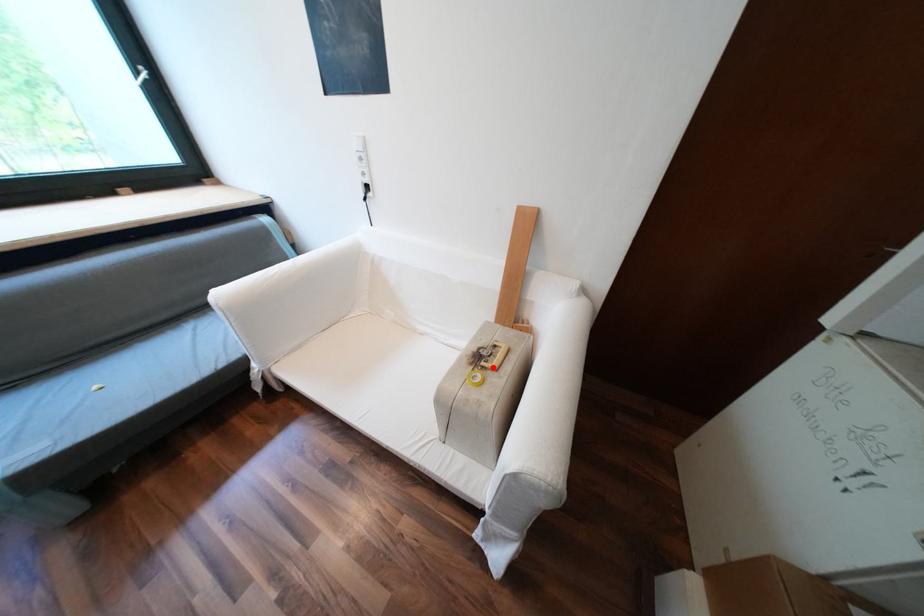
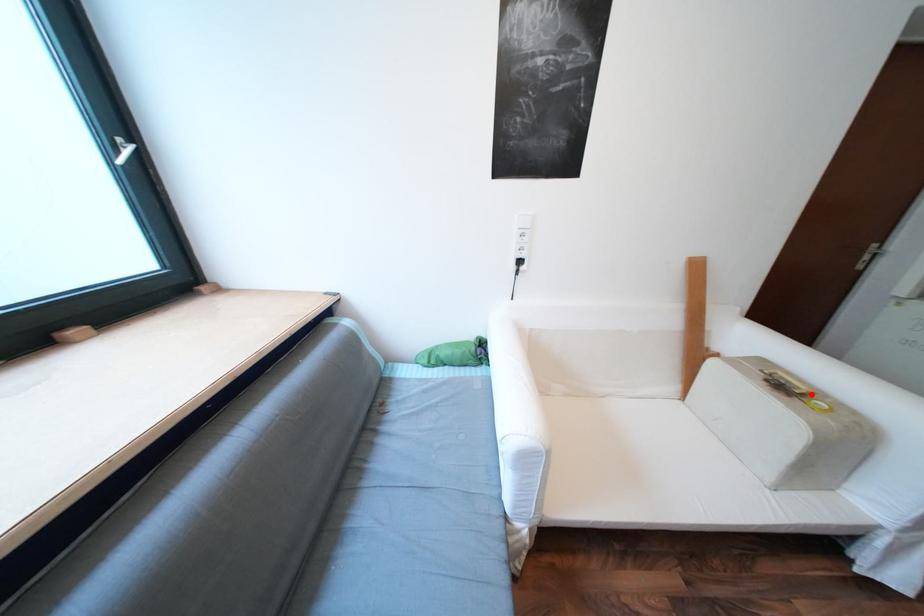
I am providing you with two images of the same scene from different viewpoints. A red point is marked on the first image and another point is marked on the second image. Are the points marked in image1 and image2 representing the same 3D position?

Yes